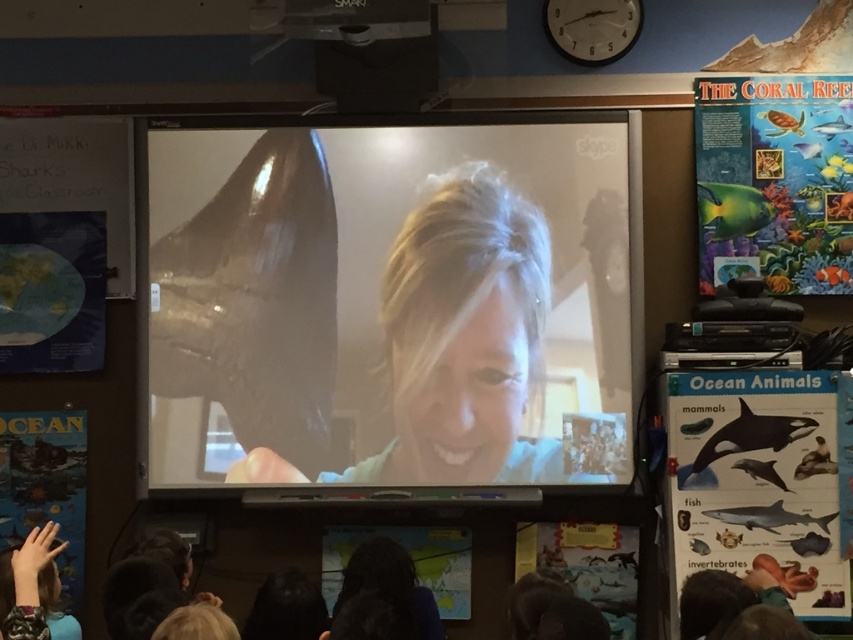
From the picture: Can you confirm if matte plastic screen at center is positioned to the right of ocean-themed poster at lower left?

Correct, you'll find matte plastic screen at center to the right of ocean-themed poster at lower left.

Image resolution: width=853 pixels, height=640 pixels. What are the coordinates of `matte plastic screen at center` in the screenshot? It's located at (393, 305).

You are a GUI agent. You are given a task and a screenshot of the screen. Output one action in this format:
    pyautogui.click(x=<x>, y=<y>)
    Task: Click on the matte plastic screen at center
    Image resolution: width=853 pixels, height=640 pixels.
    Given the screenshot: What is the action you would take?
    pos(393,305)

Is matte plastic screen at center to the right of matte paper poster at lower center from the viewer's perspective?

No, matte plastic screen at center is not to the right of matte paper poster at lower center.

Is matte plastic screen at center below matte paper poster at lower center?

No.

Image resolution: width=853 pixels, height=640 pixels. In order to click on matte plastic screen at center in this screenshot , I will do `click(393, 305)`.

Image resolution: width=853 pixels, height=640 pixels. I want to click on matte plastic screen at center, so click(x=393, y=305).

Find the location of a particular element. The height and width of the screenshot is (640, 853). blue matte globe at left is located at coordinates (51, 291).

Can you confirm if blue matte globe at left is shorter than ocean-themed poster at lower left?

Correct, blue matte globe at left is not as tall as ocean-themed poster at lower left.

Find the location of a particular element. The height and width of the screenshot is (640, 853). blue matte globe at left is located at coordinates (51, 291).